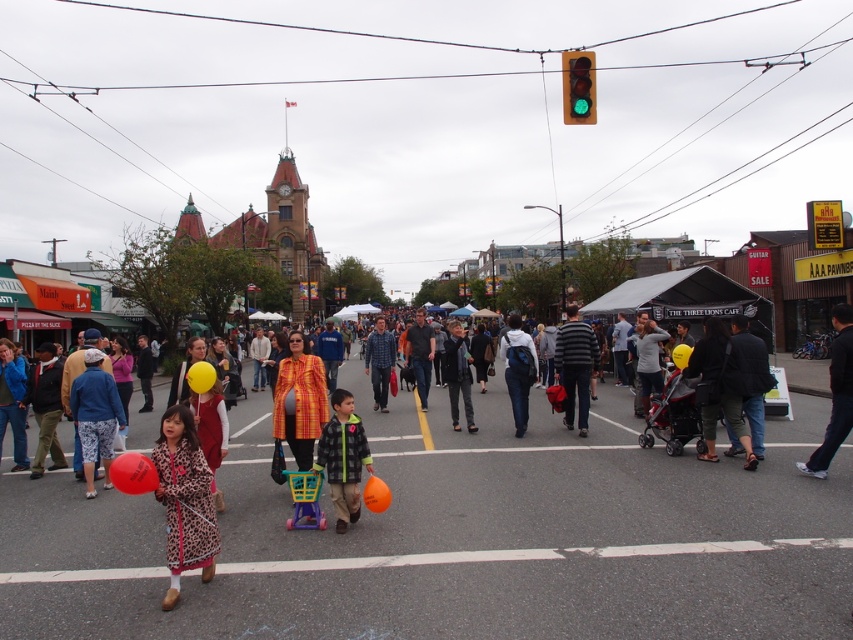
You are a photographer trying to capture both the blue denim jacket at center and the leopard print dress at center in a single frame. Which subject should you focus on first to ensure both are in the frame?

The blue denim jacket at center is much taller than the leopard print dress at center, so you should focus on the blue denim jacket at center first to ensure both are in the frame.